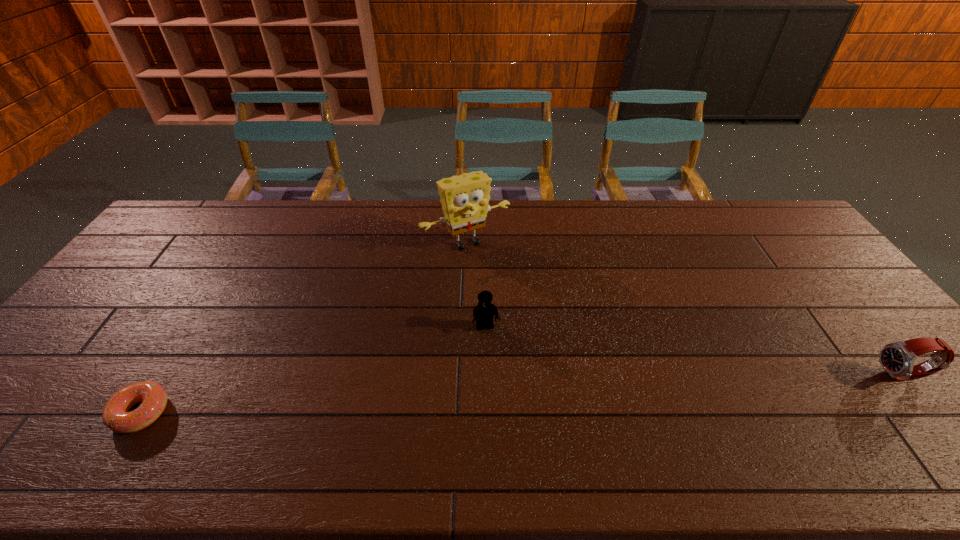
Where is `object at the near right corner`? This screenshot has width=960, height=540. object at the near right corner is located at coordinates (898, 358).

This screenshot has width=960, height=540. Find the location of `vacant space at the far edge of the desktop`. vacant space at the far edge of the desktop is located at coordinates (303, 204).

This screenshot has width=960, height=540. I want to click on vacant space at the near edge of the desktop, so click(x=410, y=410).

The width and height of the screenshot is (960, 540). In order to click on vacant space at the left edge in this screenshot , I will do `click(168, 258)`.

In the image, there is a desktop. Where is `vacant space at the right edge`? vacant space at the right edge is located at coordinates (890, 388).

Locate an element on the screen. The image size is (960, 540). vacant region between the watch and the third nearest object is located at coordinates (694, 352).

Identify the location of vacant area that lies between the Lego and the doughnut. (314, 370).

This screenshot has width=960, height=540. What are the coordinates of `free space between the watch and the leftmost object` in the screenshot? It's located at point(522,394).

Where is `free space between the leftmost object and the second farthest object`? Image resolution: width=960 pixels, height=540 pixels. free space between the leftmost object and the second farthest object is located at coordinates (314, 370).

The width and height of the screenshot is (960, 540). In order to click on free space between the shortest object and the third nearest object in this screenshot , I will do `click(314, 370)`.